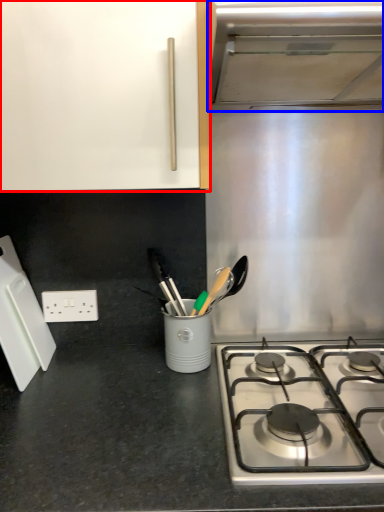
Question: Which point is closer to the camera, cabinetry (highlighted by a red box) or vent (highlighted by a blue box)?

Choices:
 (A) cabinetry
 (B) vent

Answer: (B)